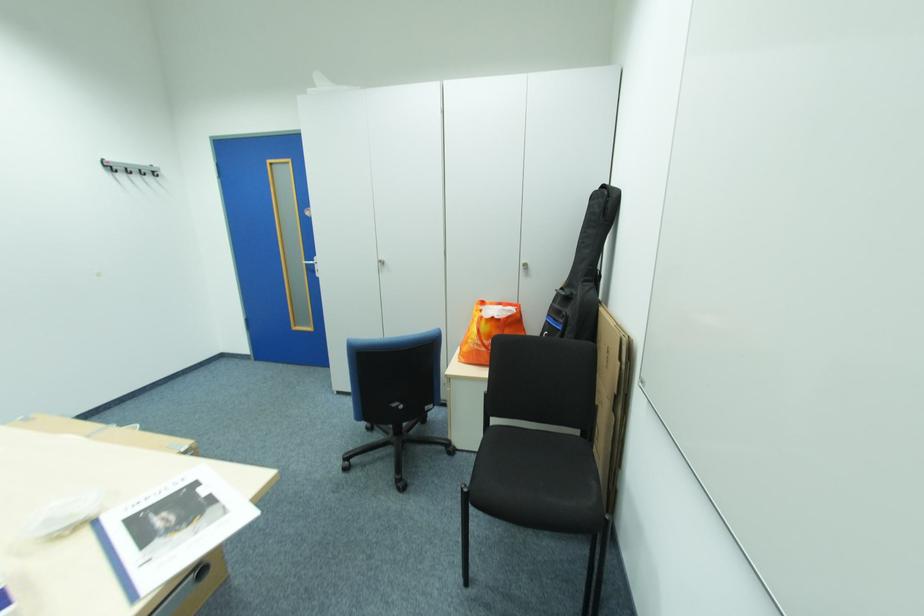
In order to click on black chair sitting surface in this screenshot , I will do `click(537, 480)`.